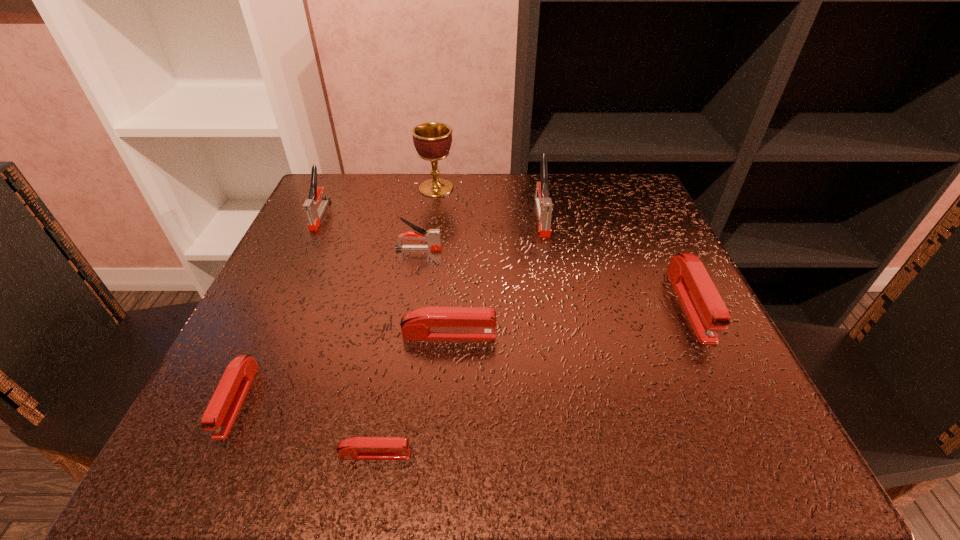
You are a GUI agent. You are given a task and a screenshot of the screen. Output one action in this format:
    pyautogui.click(x=<x>, y=<y>)
    Task: Click on the golden chalice
    
    Given the screenshot: What is the action you would take?
    pyautogui.click(x=432, y=140)

Identify the location of chalice. (432, 140).

Identify the location of the rightmost gray stapler. Image resolution: width=960 pixels, height=540 pixels. (544, 205).

Find the location of `the second object from right to left`. the second object from right to left is located at coordinates (544, 205).

The image size is (960, 540). I want to click on the second smallest gray stapler, so click(310, 206).

I want to click on the third tallest object, so click(x=310, y=206).

Find the location of a particular element. the fifth nearest object is located at coordinates (432, 236).

Where is `the fifth nearest stapler`? This screenshot has width=960, height=540. the fifth nearest stapler is located at coordinates (432, 236).

This screenshot has height=540, width=960. Find the location of `the biggest red stapler`. the biggest red stapler is located at coordinates (703, 305).

Find the location of a particular element. This screenshot has height=540, width=960. the rightmost stapler is located at coordinates (703, 305).